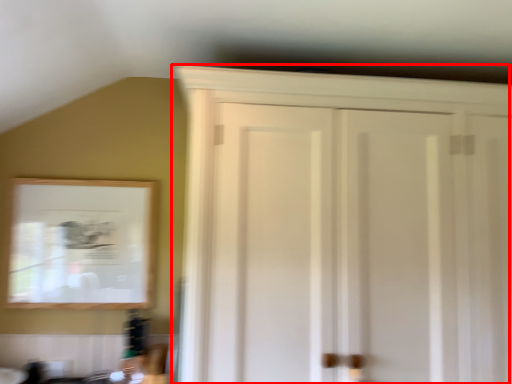
Question: From the image's perspective, where is cupboard (annotated by the red box) located in relation to mirror in the image?

Choices:
 (A) above
 (B) below

Answer: (A)